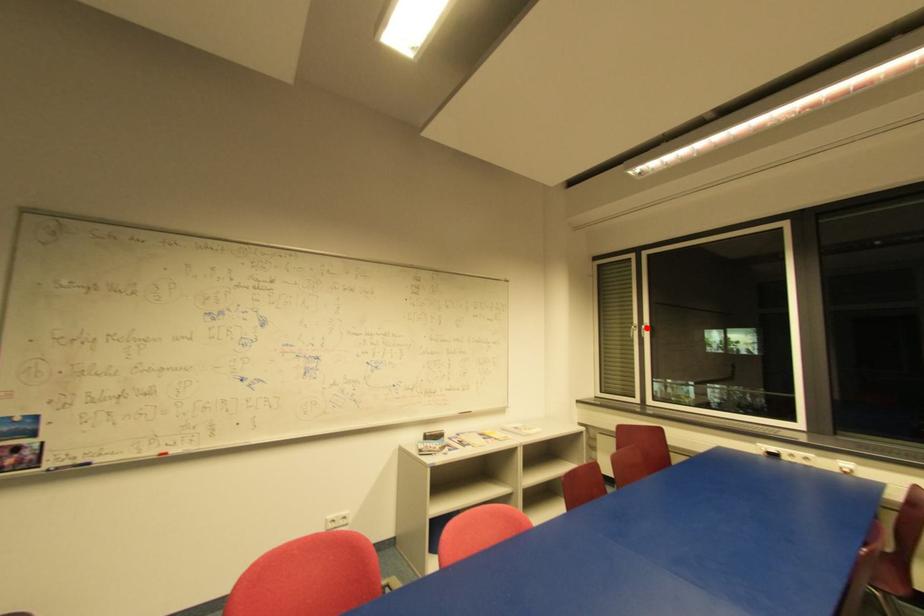
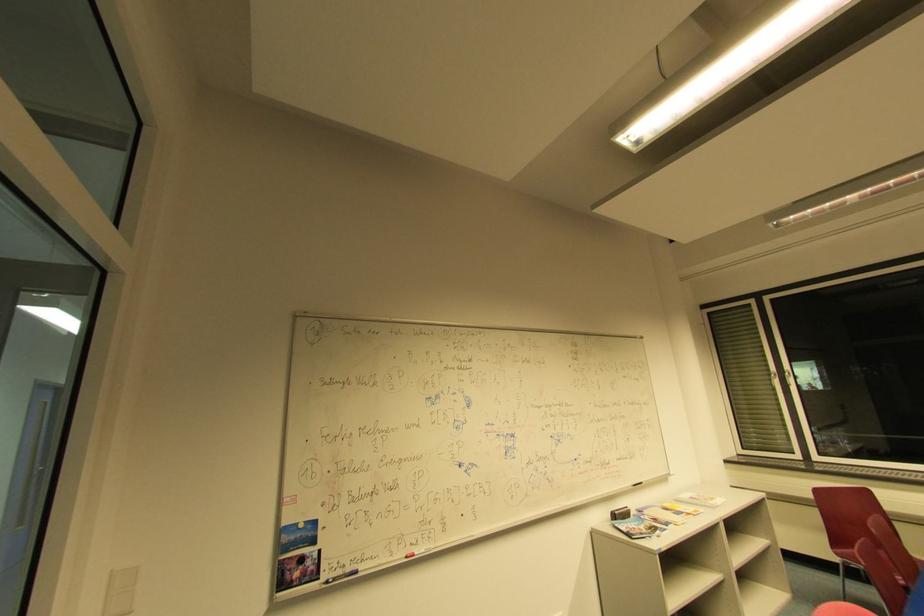
In the second image, find the point that corresponds to the highlighted location in the first image.

(791, 375)